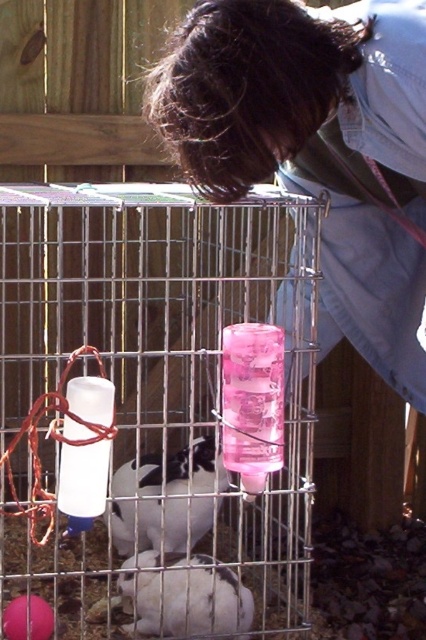
You are a caretaker who needs to ensure the pink plastic water bottle at center is accessible to the white fur rabbit at lower center. Given that the rabbit is smaller than the bottle, can the rabbit reach the water bottle?

The pink plastic water bottle at center is larger in size than the white fur rabbit at lower center, but since the bottle is placed at the center of the cage and the rabbit is at lower center, the rabbit can still reach the water bottle as they are positioned close to each other within the enclosure.

You are a visitor at the petting zoo and see the pink plastic water bottle at center and the white fur rabbit at lower center inside the enclosure. Which object is positioned to the right side of the enclosure?

The white fur rabbit at lower center is positioned to the right side of the enclosure because the pink plastic water bottle at center is to the left of it.